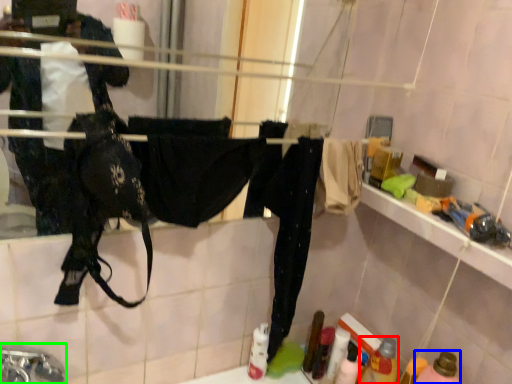
Question: Estimate the real-world distances between objects in this image. Which object is farther from bottle (highlighted by a red box), bottle (highlighted by a blue box) or faucet (highlighted by a green box)?

Choices:
 (A) bottle
 (B) faucet

Answer: (B)